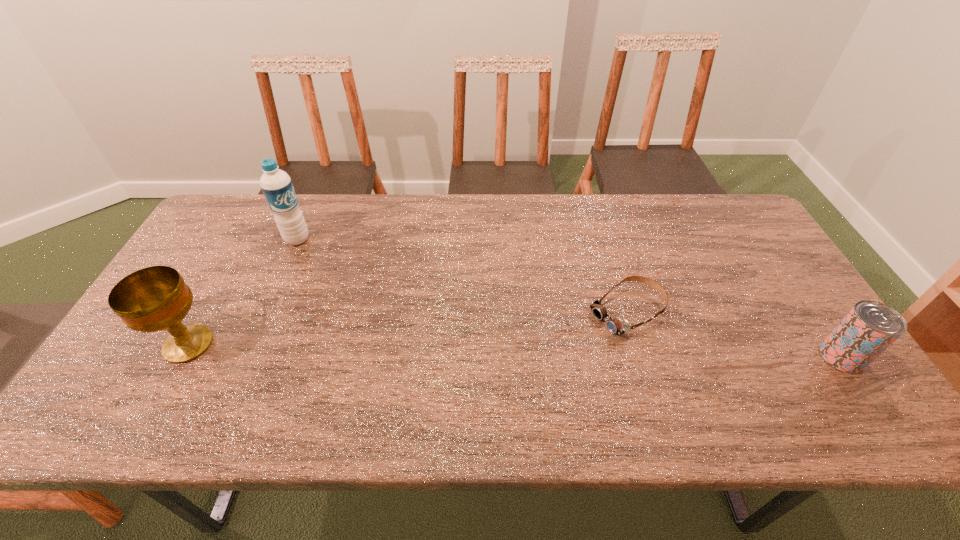
The height and width of the screenshot is (540, 960). What are the coordinates of `vacant region located 0.180m on the label of the tallest object` in the screenshot? It's located at (338, 274).

This screenshot has width=960, height=540. In order to click on free space located 0.370m on the label of the tallest object in this screenshot , I will do `click(378, 309)`.

Locate an element on the screen. vacant space located on the label of the tallest object is located at coordinates (349, 284).

This screenshot has width=960, height=540. Find the location of `blank space located 0.260m on the front-facing side of the shortest object`. blank space located 0.260m on the front-facing side of the shortest object is located at coordinates coord(516,375).

Where is `free space located 0.210m on the front-facing side of the shortest object`? The width and height of the screenshot is (960, 540). free space located 0.210m on the front-facing side of the shortest object is located at coordinates (533, 365).

Find the location of `free region located 0.170m on the front-facing side of the shortest object`. free region located 0.170m on the front-facing side of the shortest object is located at coordinates (546, 357).

At what (x,y) coordinates should I click in order to perform the action: click on object at the far edge. Please return your answer as a coordinate pair (x, y). Image resolution: width=960 pixels, height=540 pixels. Looking at the image, I should click on (276, 184).

Where is `chalice located in the near edge section of the desktop`? chalice located in the near edge section of the desktop is located at coordinates (156, 298).

At what (x,y) coordinates should I click in order to perform the action: click on beer can that is at the near edge. Please return your answer as a coordinate pair (x, y). The image size is (960, 540). Looking at the image, I should click on (870, 327).

You are a GUI agent. You are given a task and a screenshot of the screen. Output one action in this format:
    pyautogui.click(x=<x>, y=<y>)
    Task: Click on the object located in the left edge section of the desktop
    
    Given the screenshot: What is the action you would take?
    pyautogui.click(x=156, y=298)